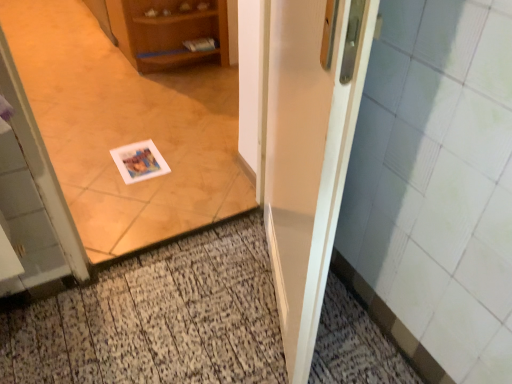
This screenshot has width=512, height=384. I want to click on free point to the right of white paper postcard at center, so click(196, 160).